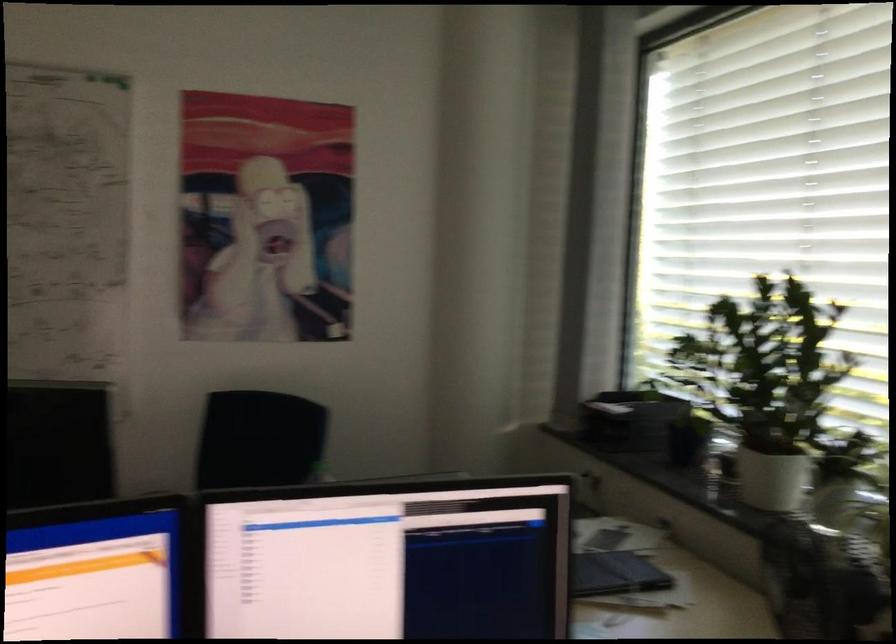
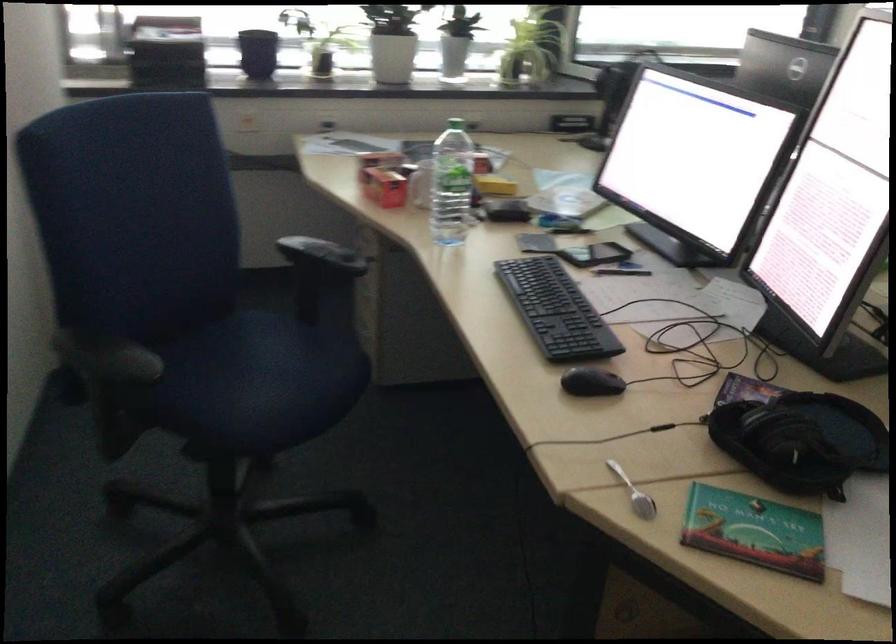
The point at (x=776, y=489) is marked in the first image. Where is the corresponding point in the second image?

(392, 58)